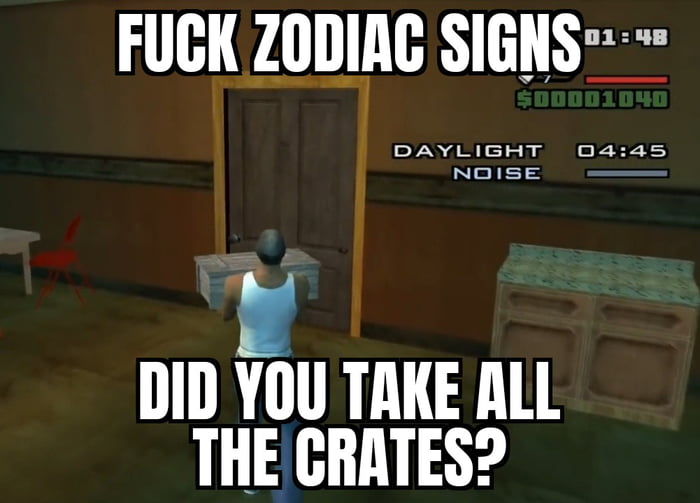
Find the location of `floor`. floor is located at coordinates (60, 391).